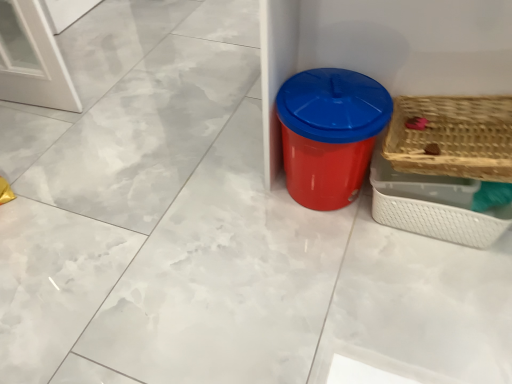
Where is `red plastic bin at center`? This screenshot has width=512, height=384. red plastic bin at center is located at coordinates (329, 133).

How different are the orientations of red plastic bin at center and woven wood basket at right, placed as the second basket when sorted from top to bottom, in degrees?

The facing directions of red plastic bin at center and woven wood basket at right, placed as the second basket when sorted from top to bottom, are 2.08 degrees apart.

Does red plastic bin at center have a larger size compared to woven wood basket at right, placed as the second basket when sorted from top to bottom?

Indeed, red plastic bin at center has a larger size compared to woven wood basket at right, placed as the second basket when sorted from top to bottom.

Does point (347, 178) come closer to viewer compared to point (406, 224)?

No, it is behind (406, 224).

From the image's perspective, who appears lower, red plastic bin at center or woven wood basket at right, placed as the second basket when sorted from top to bottom?

woven wood basket at right, placed as the second basket when sorted from top to bottom.

Can you see red plastic bin at center touching woven wood basket at right, the 2th basket in the bottom-to-top sequence?

No.

In the image, is red plastic bin at center positioned in front of or behind woven wood basket at right, the 2th basket in the bottom-to-top sequence?

In the image, red plastic bin at center appears behind woven wood basket at right, the 2th basket in the bottom-to-top sequence.

Which is less distant, (500, 229) or (284, 123)?

Point (500, 229) is farther from the camera than point (284, 123).

From a real-world perspective, is woven wood basket at right, placed as the second basket when sorted from top to bottom, positioned above or below red plastic bin at center?

woven wood basket at right, placed as the second basket when sorted from top to bottom, is situated lower than red plastic bin at center in the real world.

From the image's perspective, which one is positioned lower, woven wood basket at right, placed as the second basket when sorted from top to bottom, or red plastic bin at center?

woven wood basket at right, placed as the second basket when sorted from top to bottom, is shown below in the image.

Is red plastic bin at center inside woven wood basket at right, placed as the second basket when sorted from top to bottom?

No, red plastic bin at center is not a part of woven wood basket at right, placed as the second basket when sorted from top to bottom.

Can you confirm if woven wood basket at right, placed as the second basket when sorted from top to bottom, is thinner than woven wood basket at right, the 1th basket from the top?

Yes.

From a real-world perspective, who is located higher, woven wood basket at right, which appears as the 1th basket when ordered from the bottom, or woven wood basket at right, the 1th basket from the top?

From a 3D spatial view, woven wood basket at right, the 1th basket from the top, is above.

Consider the image. Based on their sizes in the image, would you say woven wood basket at right, which appears as the 1th basket when ordered from the bottom, is bigger or smaller than woven wood basket at right, the 2th basket in the bottom-to-top sequence?

Considering their sizes, woven wood basket at right, which appears as the 1th basket when ordered from the bottom, takes up less space than woven wood basket at right, the 2th basket in the bottom-to-top sequence.

Which is closer, (x=483, y=226) or (x=437, y=128)?

Point (x=483, y=226).

In order to click on basket that appears above the woven wood basket at right, which appears as the 1th basket when ordered from the bottom (from a real-world perspective) in this screenshot , I will do `click(451, 136)`.

Which is correct: woven wood basket at right, the 2th basket in the bottom-to-top sequence, is inside woven wood basket at right, placed as the second basket when sorted from top to bottom, or outside of it?

woven wood basket at right, the 2th basket in the bottom-to-top sequence, is spatially situated outside woven wood basket at right, placed as the second basket when sorted from top to bottom.

In the scene shown: Which is closer to the camera, (413,161) or (440,191)?

The point (413,161) is more forward.

Can you confirm if woven wood basket at right, the 1th basket from the top, is positioned to the right of woven wood basket at right, placed as the second basket when sorted from top to bottom?

In fact, woven wood basket at right, the 1th basket from the top, is to the left of woven wood basket at right, placed as the second basket when sorted from top to bottom.

From the image's perspective, is woven wood basket at right, the 2th basket in the bottom-to-top sequence, located above red plastic bin at center?

No.

Is woven wood basket at right, the 1th basket from the top, completely or partially outside of red plastic bin at center?

Yes, woven wood basket at right, the 1th basket from the top, is located beyond the bounds of red plastic bin at center.

In terms of height, does woven wood basket at right, the 1th basket from the top, look taller or shorter compared to red plastic bin at center?

woven wood basket at right, the 1th basket from the top, is shorter than red plastic bin at center.

Consider the image. Can you confirm if woven wood basket at right, the 2th basket in the bottom-to-top sequence, is wider than red plastic bin at center?

In fact, woven wood basket at right, the 2th basket in the bottom-to-top sequence, might be narrower than red plastic bin at center.

In the image, there is a red plastic bin at center. Where is `basket below it (from a real-world perspective)`? basket below it (from a real-world perspective) is located at coordinates (433, 205).

Locate an element on the screen. The width and height of the screenshot is (512, 384). basket located in front of the red plastic bin at center is located at coordinates (451, 136).

Which object lies further to the anchor point woven wood basket at right, placed as the second basket when sorted from top to bottom, woven wood basket at right, the 2th basket in the bottom-to-top sequence, or red plastic bin at center?

red plastic bin at center.

Consider the image. Which object lies nearer to the anchor point woven wood basket at right, the 1th basket from the top, woven wood basket at right, placed as the second basket when sorted from top to bottom, or red plastic bin at center?

Based on the image, woven wood basket at right, placed as the second basket when sorted from top to bottom, appears to be nearer to woven wood basket at right, the 1th basket from the top.

Estimate the real-world distances between objects in this image. Which object is closer to red plastic bin at center, woven wood basket at right, the 1th basket from the top, or woven wood basket at right, placed as the second basket when sorted from top to bottom?

woven wood basket at right, placed as the second basket when sorted from top to bottom, is closer to red plastic bin at center.

When comparing their distances from red plastic bin at center, does woven wood basket at right, which appears as the 1th basket when ordered from the bottom, or woven wood basket at right, the 1th basket from the top, seem further?

woven wood basket at right, the 1th basket from the top, is further to red plastic bin at center.

Considering their positions, is red plastic bin at center positioned further to woven wood basket at right, placed as the second basket when sorted from top to bottom, than woven wood basket at right, the 1th basket from the top?

Based on the image, red plastic bin at center appears to be further to woven wood basket at right, placed as the second basket when sorted from top to bottom.

From the image, which object appears to be nearer to woven wood basket at right, the 1th basket from the top, red plastic bin at center or woven wood basket at right, placed as the second basket when sorted from top to bottom?

woven wood basket at right, placed as the second basket when sorted from top to bottom, is positioned closer to the anchor woven wood basket at right, the 1th basket from the top.

I want to click on basket located between red plastic bin at center and woven wood basket at right, placed as the second basket when sorted from top to bottom, in the left-right direction, so click(451, 136).